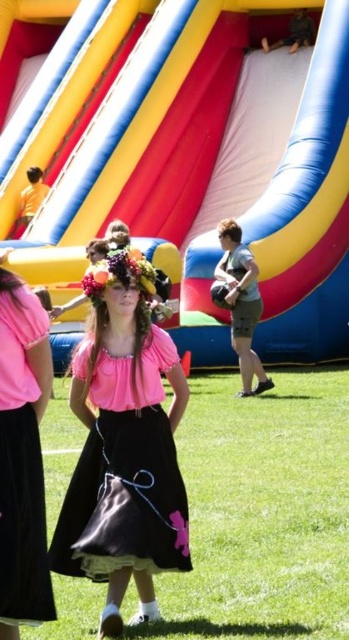
This screenshot has width=349, height=640. What do you see at coordinates (189, 160) in the screenshot?
I see `rubber inflatable slide at center` at bounding box center [189, 160].

The width and height of the screenshot is (349, 640). In order to click on rubber inflatable slide at center in this screenshot , I will do `click(189, 160)`.

Locate an element on the screen. Image resolution: width=349 pixels, height=640 pixels. rubber inflatable slide at center is located at coordinates (189, 160).

Which is in front, point (314, 64) or point (19, 598)?

Positioned in front is point (19, 598).

Who is lower down, rubber inflatable slide at center or black satin dress at center?

black satin dress at center is lower down.

The image size is (349, 640). What do you see at coordinates (189, 160) in the screenshot? I see `rubber inflatable slide at center` at bounding box center [189, 160].

Locate an element on the screen. rubber inflatable slide at center is located at coordinates (189, 160).

Is pink satin dress at center above black satin dress at center?

No, pink satin dress at center is not above black satin dress at center.

Can you confirm if pink satin dress at center is wider than black satin dress at center?

Correct, the width of pink satin dress at center exceeds that of black satin dress at center.

Is point (70, 490) positioned after point (6, 410)?

Yes, it is behind point (6, 410).

Where is `pink satin dress at center`? pink satin dress at center is located at coordinates (125, 476).